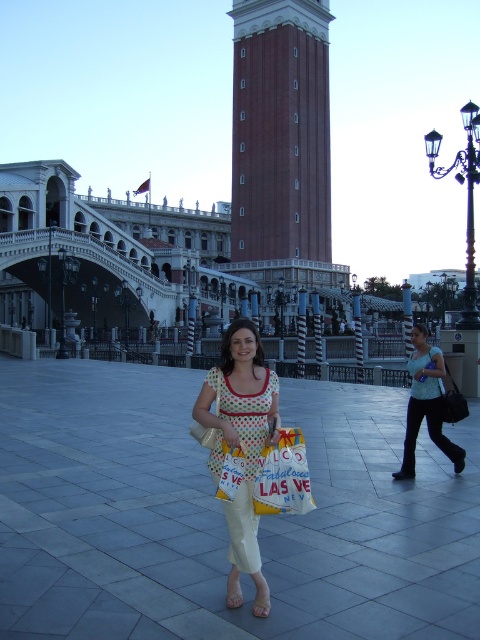
You are a photographer trying to capture the woman in the plaza. You notice the light blue fabric shirt at center and the yellow fabric shopping bag at center. Which object is positioned more to the left?

The yellow fabric shopping bag at center is positioned more to the left because the light blue fabric shirt at center is to the right of it.